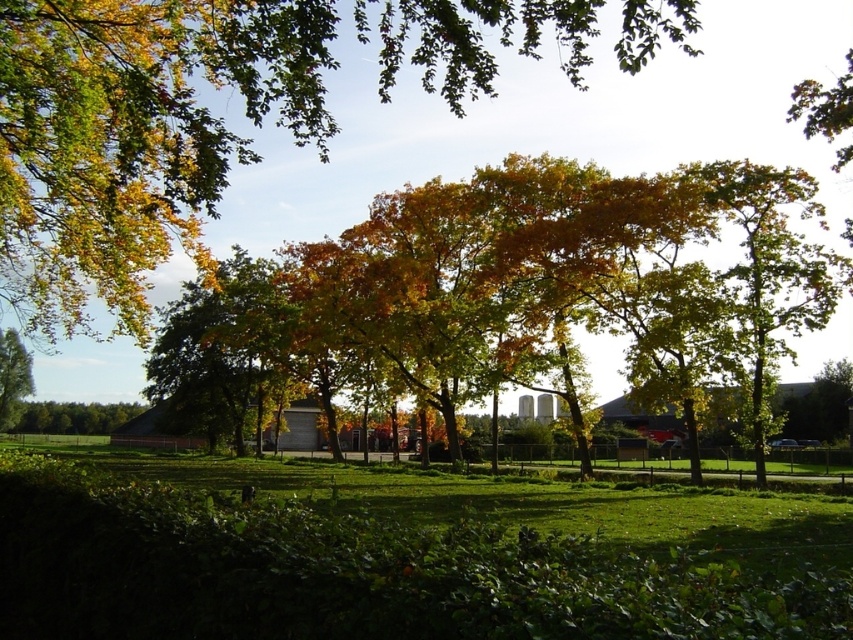
Question: Is green leafy tree at center to the right of green leafy tree at lower left from the viewer's perspective?

Choices:
 (A) yes
 (B) no

Answer: (A)

Question: Does green leafy tree at center have a lesser width compared to green leafy tree at lower left?

Choices:
 (A) no
 (B) yes

Answer: (A)

Question: Among these points, which one is farthest from the camera?

Choices:
 (A) (57, 432)
 (B) (242, 8)
 (C) (10, 364)

Answer: (A)

Question: Which of the following is the closest to the observer?

Choices:
 (A) (82, 433)
 (B) (596, 252)
 (C) (229, 552)
 (D) (10, 336)

Answer: (C)

Question: Among these objects, which one is farthest from the camera?

Choices:
 (A) green leafy tree at center
 (B) green leafy park at center
 (C) green leafy tree at left

Answer: (C)

Question: Where is green leafy tree at upper center located in relation to green leafy tree at left in the image?

Choices:
 (A) right
 (B) left

Answer: (A)